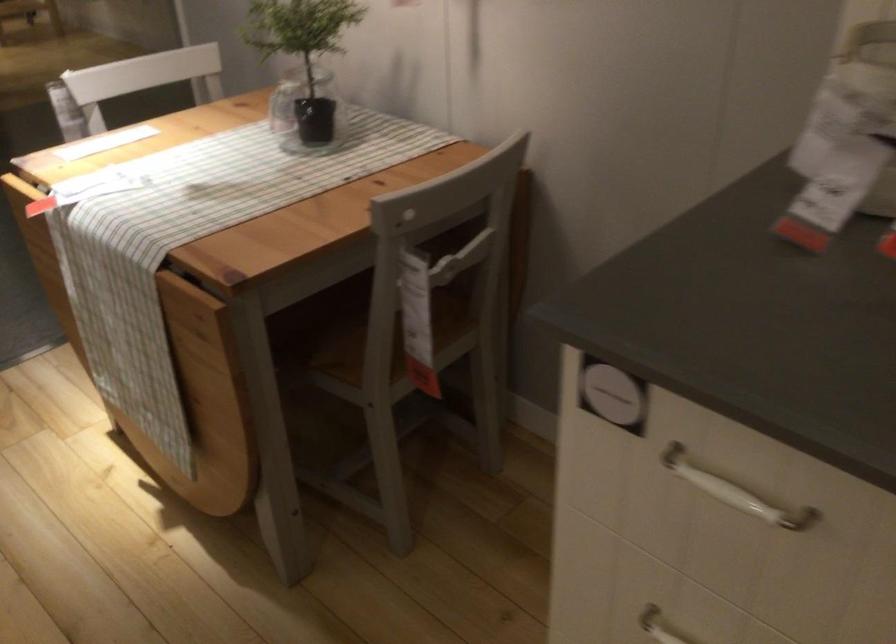
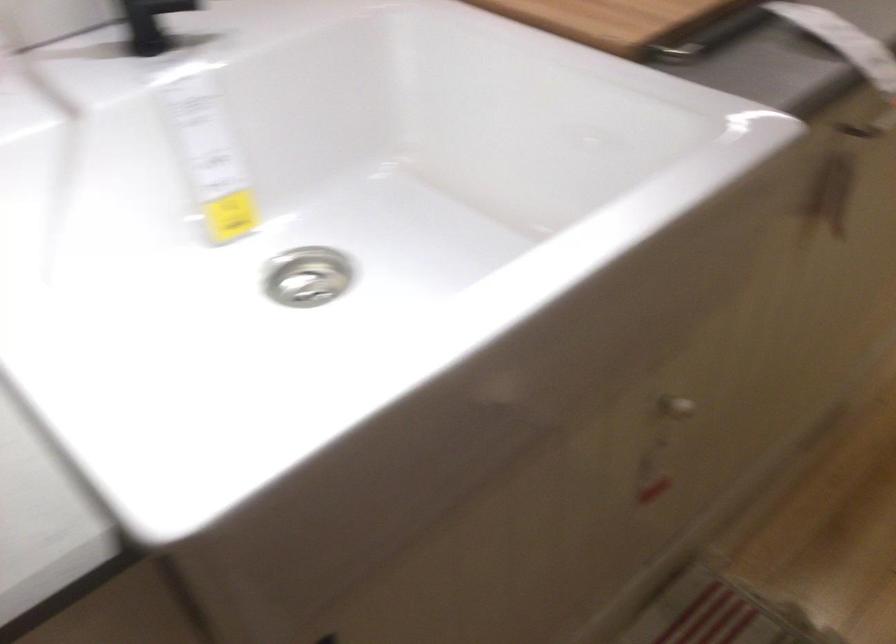
Based on the continuous images, in which direction is the camera rotating?

The rotation direction of the camera is left-down.